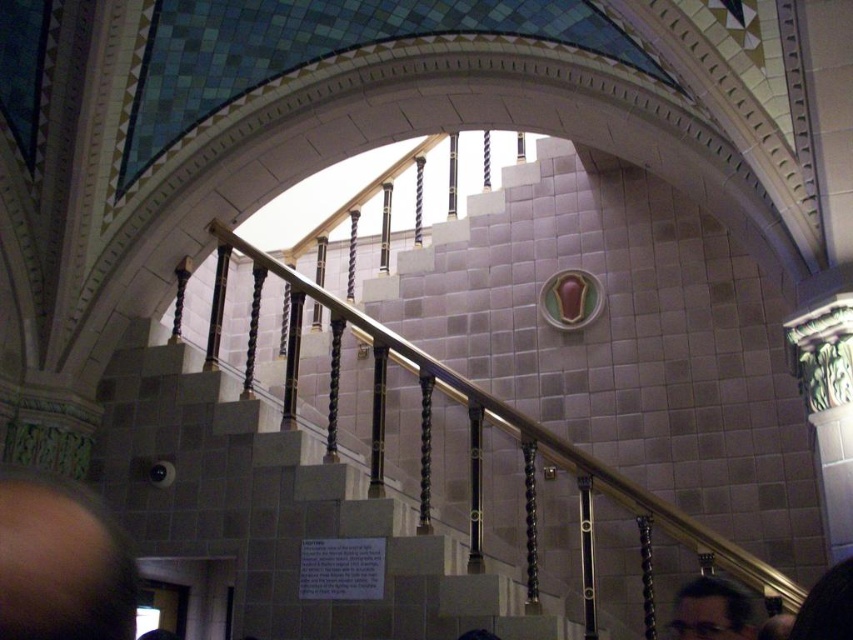
Who is taller, dark brown hair at lower right or black hair at lower right?

Standing taller between the two is dark brown hair at lower right.

Can you confirm if dark brown hair at lower right is thinner than black hair at lower right?

No, dark brown hair at lower right is not thinner than black hair at lower right.

Between point (740, 609) and point (836, 592), which one is positioned in front?

Point (836, 592)

You are a GUI agent. You are given a task and a screenshot of the screen. Output one action in this format:
    pyautogui.click(x=<x>, y=<y>)
    Task: Click on the dark brown hair at lower right
    
    Given the screenshot: What is the action you would take?
    pyautogui.click(x=712, y=611)

Is point (123, 637) closer to camera compared to point (737, 593)?

Yes, it is in front of point (737, 593).

Who is higher up, brown hair at lower left or dark brown hair at lower right?

brown hair at lower left is higher up.

Does point (16, 637) lie in front of point (694, 589)?

Yes.

Where is `brown hair at lower left`? The image size is (853, 640). brown hair at lower left is located at coordinates (61, 564).

Can you confirm if brown hair at lower left is thinner than black hair at lower right?

In fact, brown hair at lower left might be wider than black hair at lower right.

Who is shorter, brown hair at lower left or black hair at lower right?

With less height is black hair at lower right.

Is point (64, 570) farther from camera compared to point (824, 576)?

No, it is not.

Identify the location of brown hair at lower left. (61, 564).